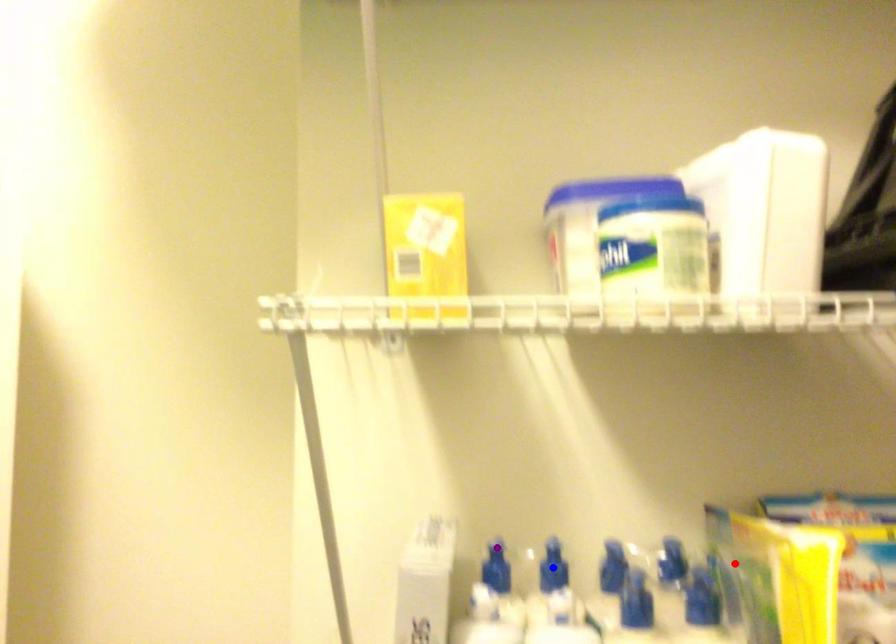
Order these from nearest to farthest:
purple point | red point | blue point

red point < blue point < purple point